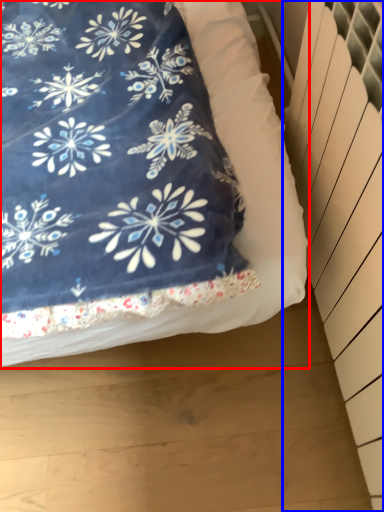
Question: Which of the following is the closest to the observer, bed (highlighted by a red box) or radiator (highlighted by a blue box)?

Choices:
 (A) bed
 (B) radiator

Answer: (B)